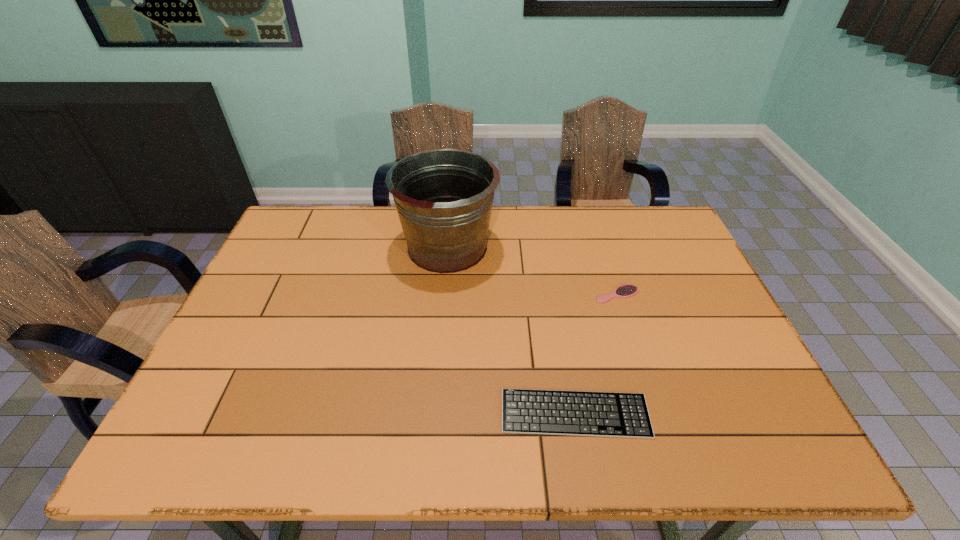
Where is `empty location between the shortest object and the second tallest object`? empty location between the shortest object and the second tallest object is located at coordinates (596, 354).

I want to click on free space between the second tallest object and the shortest object, so click(x=596, y=354).

Where is `free area in between the hairbrush and the nearest object`? The image size is (960, 540). free area in between the hairbrush and the nearest object is located at coordinates (596, 354).

Identify the location of free space that is in between the computer keyboard and the second tallest object. (596, 354).

Where is `free space between the nearest object and the hairbrush`? free space between the nearest object and the hairbrush is located at coordinates (596, 354).

Locate an element on the screen. The image size is (960, 540). vacant point located between the tallest object and the computer keyboard is located at coordinates (511, 330).

Locate an element on the screen. The image size is (960, 540). vacant area that lies between the tallest object and the computer keyboard is located at coordinates (511, 330).

Locate an element on the screen. This screenshot has width=960, height=540. empty location between the tallest object and the nearest object is located at coordinates (511, 330).

Identify which object is the closest to the hairbrush. Please provide its 2D coordinates. Your answer should be formatted as a tuple, i.e. [(x, y)], where the tuple contains the x and y coordinates of a point satisfying the conditions above.

[(444, 197)]

You are a GUI agent. You are given a task and a screenshot of the screen. Output one action in this format:
    pyautogui.click(x=<x>, y=<y>)
    Task: Click on the object that can be found as the closest to the second tallest object
    Image resolution: width=960 pixels, height=540 pixels.
    Given the screenshot: What is the action you would take?
    pyautogui.click(x=444, y=197)